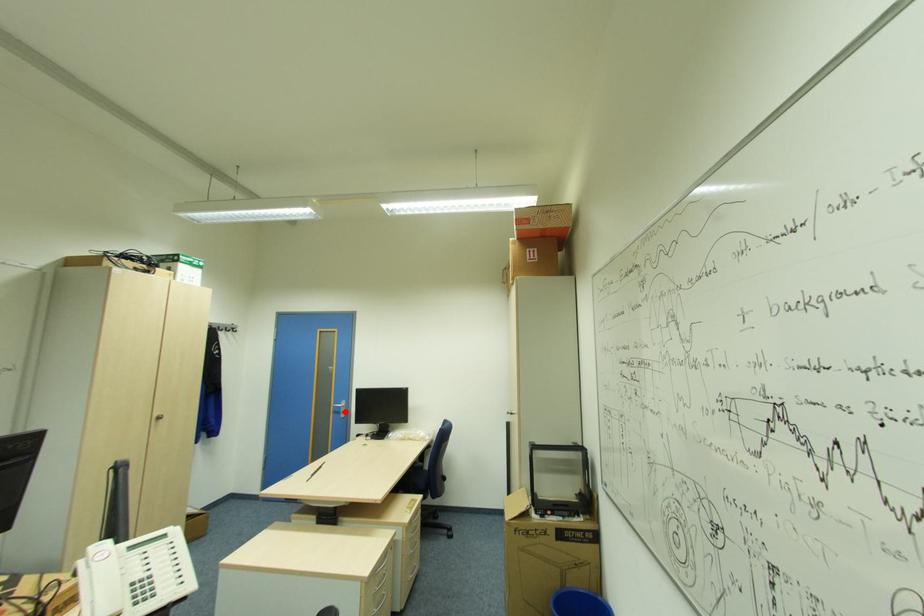
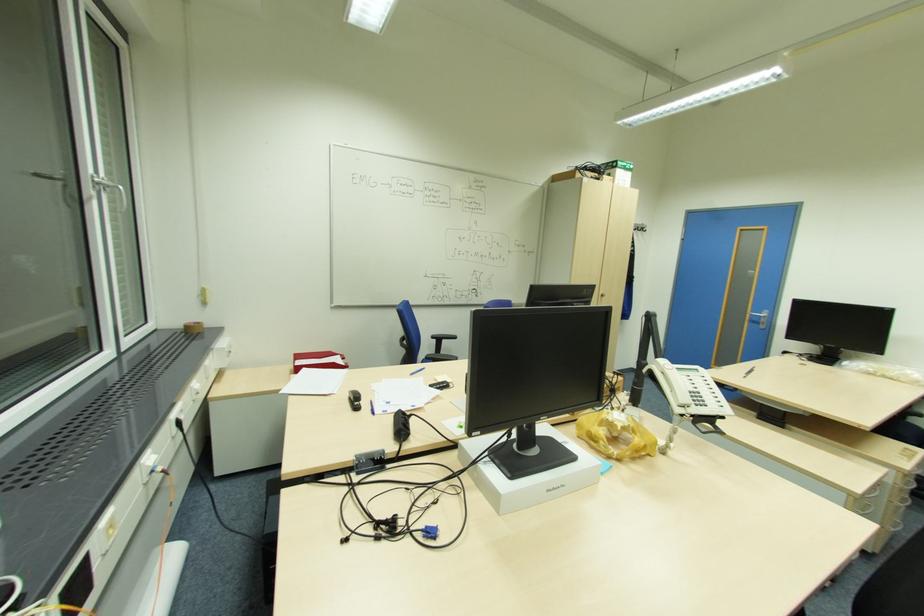
Question: A red point is marked in image1. In image2, is the corresponding 3D point closer to the camera or farther? Reply with the corresponding letter.

Choices:
 (A) The corresponding 3D point is closer.
 (B) The corresponding 3D point is farther.

Answer: (A)